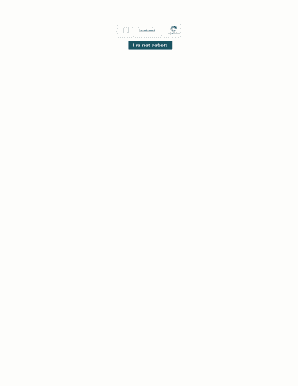
What are the coordinates of `box` in the screenshot? It's located at (173, 378), (124, 29).